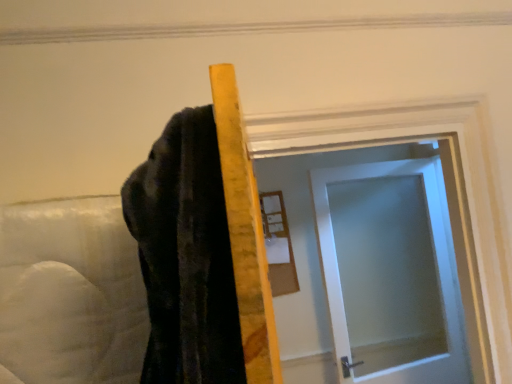
Question: Is satin white door at center spatially inside wooden framed mirror at upper center, or outside of it?

Choices:
 (A) outside
 (B) inside

Answer: (A)

Question: In the image, is satin white door at center positioned in front of or behind wooden framed mirror at upper center?

Choices:
 (A) behind
 (B) front

Answer: (B)

Question: Is point (401, 274) positioned closer to the camera than point (280, 276)?

Choices:
 (A) closer
 (B) farther

Answer: (B)

Question: Considering the positions of point (271, 258) and point (338, 266), is point (271, 258) closer or farther from the camera than point (338, 266)?

Choices:
 (A) farther
 (B) closer

Answer: (B)

Question: In terms of size, does wooden framed mirror at upper center appear bigger or smaller than satin white door at center?

Choices:
 (A) small
 (B) big

Answer: (A)

Question: Would you say wooden framed mirror at upper center is to the left or to the right of satin white door at center in the picture?

Choices:
 (A) right
 (B) left

Answer: (B)

Question: From a real-world perspective, is wooden framed mirror at upper center above or below satin white door at center?

Choices:
 (A) below
 (B) above

Answer: (B)